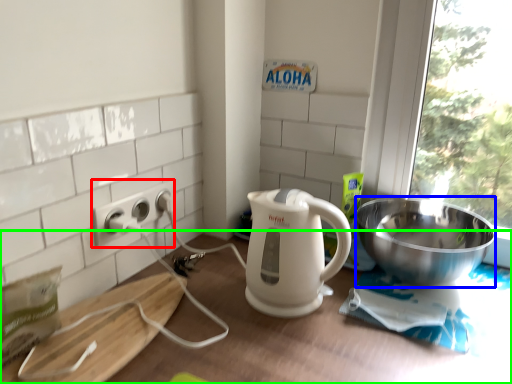
Question: Which object is positioned farthest from power outlet (highlighted by a red box)? Select from bowl (highlighted by a blue box) and table (highlighted by a green box).

Choices:
 (A) bowl
 (B) table

Answer: (A)